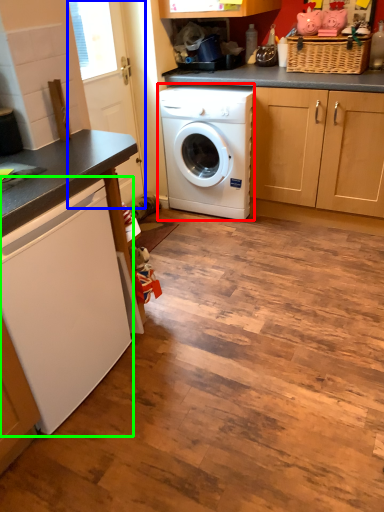
Question: Estimate the real-world distances between objects in this image. Which object is closer to washing machine (highlighted by a red box), screen door (highlighted by a blue box) or washing machine (highlighted by a green box)?

Choices:
 (A) screen door
 (B) washing machine

Answer: (A)